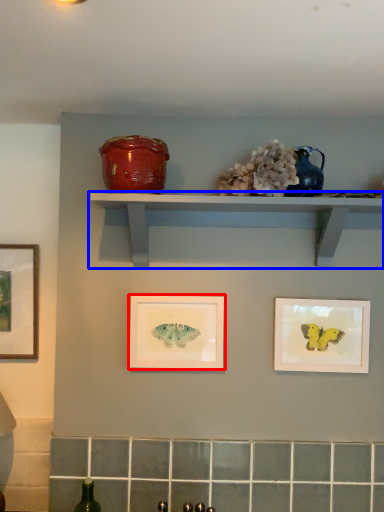
Question: Which object appears farthest to the camera in this image, picture frame (highlighted by a red box) or shelf (highlighted by a blue box)?

Choices:
 (A) picture frame
 (B) shelf

Answer: (A)